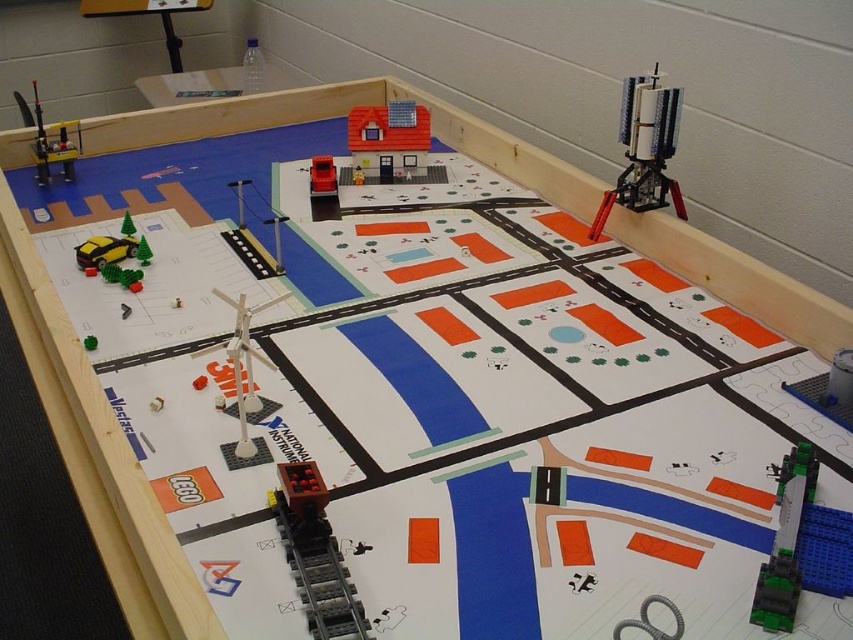
Can you confirm if white plastic wind turbine at center is thinner than brick red car at center?

In fact, white plastic wind turbine at center might be wider than brick red car at center.

The width and height of the screenshot is (853, 640). Describe the element at coordinates (242, 364) in the screenshot. I see `white plastic wind turbine at center` at that location.

The width and height of the screenshot is (853, 640). Identify the location of white plastic wind turbine at center. (242, 364).

Is metallic silver crane at upper left to the left of green plastic car at lower left from the viewer's perspective?

Yes, metallic silver crane at upper left is to the left of green plastic car at lower left.

Can you confirm if metallic silver crane at upper left is wider than green plastic car at lower left?

Correct, the width of metallic silver crane at upper left exceeds that of green plastic car at lower left.

Where is `metallic silver crane at upper left`? metallic silver crane at upper left is located at coordinates (50, 140).

I want to click on metallic silver crane at upper left, so click(50, 140).

Between point (328, 625) and point (207, 352), which one is positioned behind?

Positioned behind is point (207, 352).

Is brick red train car at bottom center bigger than white plastic wind turbine at center?

No.

Who is more distant from viewer, (323, 564) or (239, 348)?

The point (239, 348) is behind.

In order to click on brick red train car at bottom center in this screenshot , I will do `click(315, 554)`.